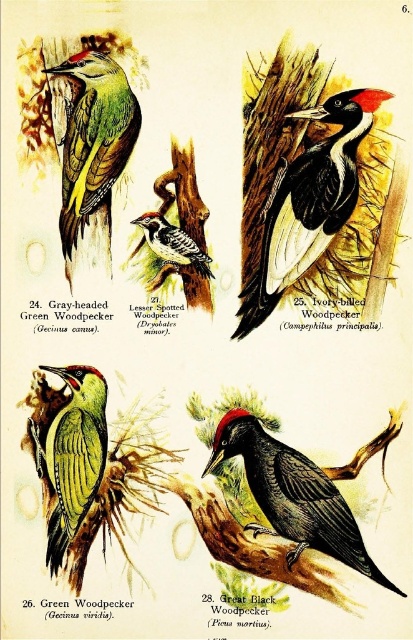
Question: Is shiny black woodpecker at lower right below green matte woodpecker at center?

Choices:
 (A) yes
 (B) no

Answer: (A)

Question: Which is nearer to the green matte woodpecker at center?

Choices:
 (A) black glossy ivory-billed woodpecker at upper right
 (B) green matte woodpecker at upper left

Answer: (B)

Question: Can you confirm if green matte woodpecker at upper left is positioned below speckled brown woodpecker at center?

Choices:
 (A) no
 (B) yes

Answer: (A)

Question: Which point is farther to the camera?

Choices:
 (A) (106, 224)
 (B) (260, 454)
 (C) (165, 221)

Answer: (A)

Question: Based on their relative distances, which object is farther from the black glossy ivory-billed woodpecker at upper right?

Choices:
 (A) green matte woodpecker at center
 (B) speckled brown woodpecker at center
 (C) green matte woodpecker at upper left

Answer: (A)

Question: Is black glossy ivory-billed woodpecker at upper right bigger than green matte woodpecker at upper left?

Choices:
 (A) no
 (B) yes

Answer: (B)